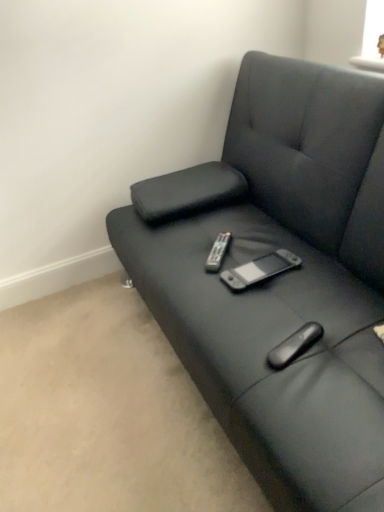
Question: From the image's perspective, relative to matte black couch at center, is black plastic remote at center above or below?

Choices:
 (A) above
 (B) below

Answer: (B)

Question: In the image, is black plastic remote at center positioned in front of or behind matte black couch at center?

Choices:
 (A) front
 (B) behind

Answer: (B)

Question: Which is correct: black plastic remote at center is inside matte black couch at center, or outside of it?

Choices:
 (A) inside
 (B) outside

Answer: (A)

Question: Considering their positions, is matte black couch at center located in front of or behind black plastic remote at center?

Choices:
 (A) behind
 (B) front

Answer: (B)

Question: In the image, is matte black couch at center on the left side or the right side of black plastic remote at center?

Choices:
 (A) left
 (B) right

Answer: (B)

Question: Which is correct: matte black couch at center is inside black plastic remote at center, or outside of it?

Choices:
 (A) inside
 (B) outside

Answer: (B)

Question: Does point click(160, 230) appear closer or farther from the camera than point click(211, 266)?

Choices:
 (A) farther
 (B) closer

Answer: (A)